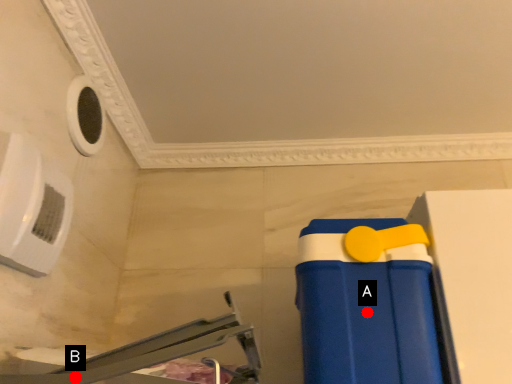
Question: Two points are circled on the image, labeled by A and B beside each circle. Which point is closer to the camera taking this photo?

Choices:
 (A) A is closer
 (B) B is closer

Answer: (B)